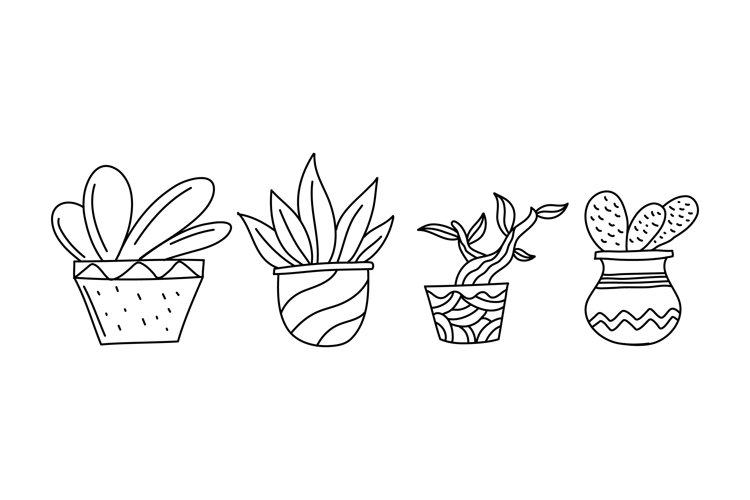
Locate an element on the screen. empty space to the top of second vase is located at coordinates (343, 90).